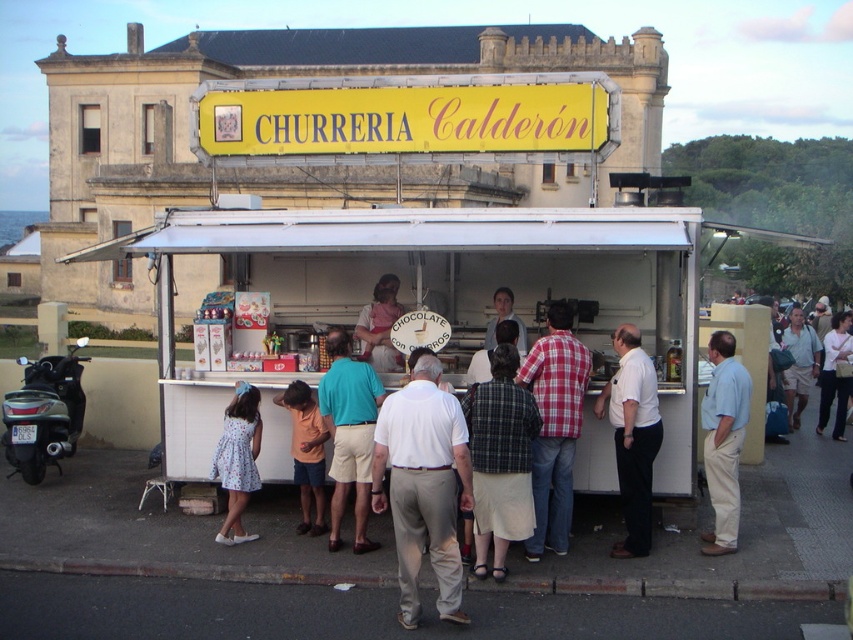
You are standing at the entrance of Churreria Calderon and see a customer wearing a white shirt at center and another wearing a teal fabric shirt at center. If you want to greet both customers without moving from your spot, which customer is closer to you?

The white shirt at center is 6.54 feet away from the teal fabric shirt at center, so you cannot determine which is closer to you based on this information alone. You need more details about their individual distances from your position.

You are a delivery person with a 1.8 meter long package. You need to navigate between the plaid fabric jacket at center and the floral dress at center. Can you fit the package through the space between them without tilting it?

The space between the plaid fabric jacket at center and the floral dress at center is 2.13 meters. Since the package is 1.8 meters long, it can fit through the space without tilting.

You are a customer at Churreria Calderon and you want to hand your jacket to the person wearing khaki cotton shorts at center. The plaid fabric jacket at center is yours. Can you reach them without moving from your current position?

The distance between the plaid fabric jacket at center and the khaki cotton shorts at center is 7.68 meters, so you cannot reach them without moving closer.